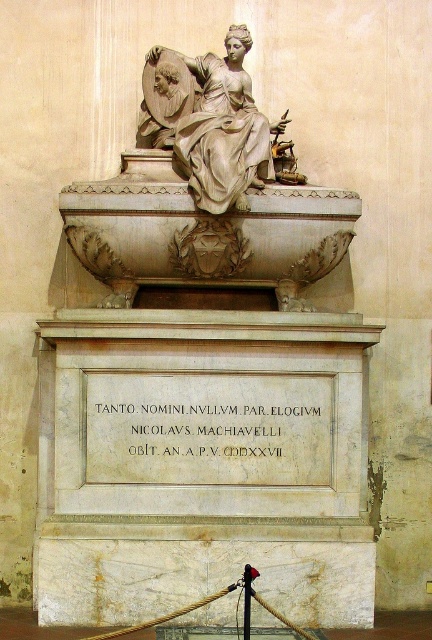
You are an art historian examining the monument. You notice the black stone inscription at center and the polished marble statue at upper center. Which object is located higher up in the monument?

The polished marble statue at upper center is located higher up than the black stone inscription at center, as the inscription is positioned under the statue.

You are an art conservator tasked with measuring the distance between the white marble statue at center and the black stone inscription at center. According to the scene description, which object is located to the left of the other?

The black stone inscription at center is to the left of the white marble statue at center because the white marble statue at center is positioned on the right side of the black stone inscription at center.

You are standing in the grand interior space of a church or cathedral facing the classical marble monument. There are two points marked on the floor in front of you. The first point is at coordinate point(282, 419) and the second point is at coordinate point(174, 81). If you were to walk from the first point to the second point, would you be moving towards the monument or away from it?

Since point(282, 419) is in front of point(174, 81), moving from the first point to the second point would mean moving away from the monument.